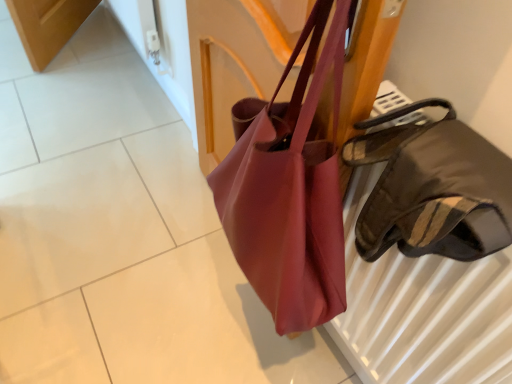
Question: From the image's perspective, is satin brown handbag at right, marked as the 1th handbag in a front-to-back arrangement, located above or below matte pink tote at center, the first handbag positioned from the back?

Choices:
 (A) above
 (B) below

Answer: (B)

Question: From a real-world perspective, is satin brown handbag at right, which appears as the 2th handbag when viewed from the back, above or below matte pink tote at center, the second handbag in the front-to-back sequence?

Choices:
 (A) below
 (B) above

Answer: (B)

Question: Considering the real-world distances, which object is closest to the matte pink fabric bag at center?

Choices:
 (A) matte pink tote at center, the second handbag when ordered from right to left
 (B) satin brown handbag at right, marked as the 1th handbag in a front-to-back arrangement

Answer: (A)

Question: Estimate the real-world distances between objects in this image. Which object is farther from the satin brown handbag at right, marked as the 1th handbag in a front-to-back arrangement?

Choices:
 (A) matte pink fabric bag at center
 (B) matte pink tote at center, the second handbag when ordered from right to left

Answer: (A)